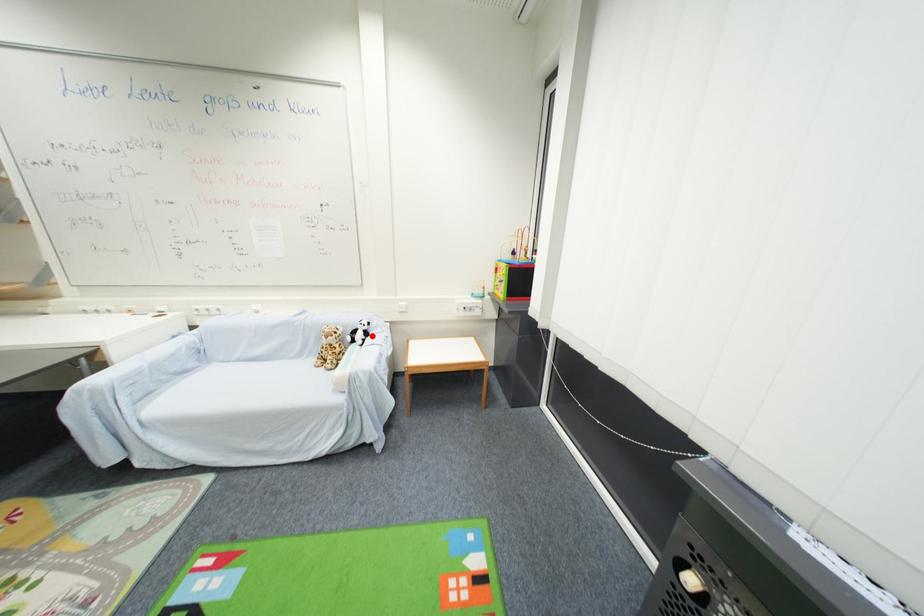
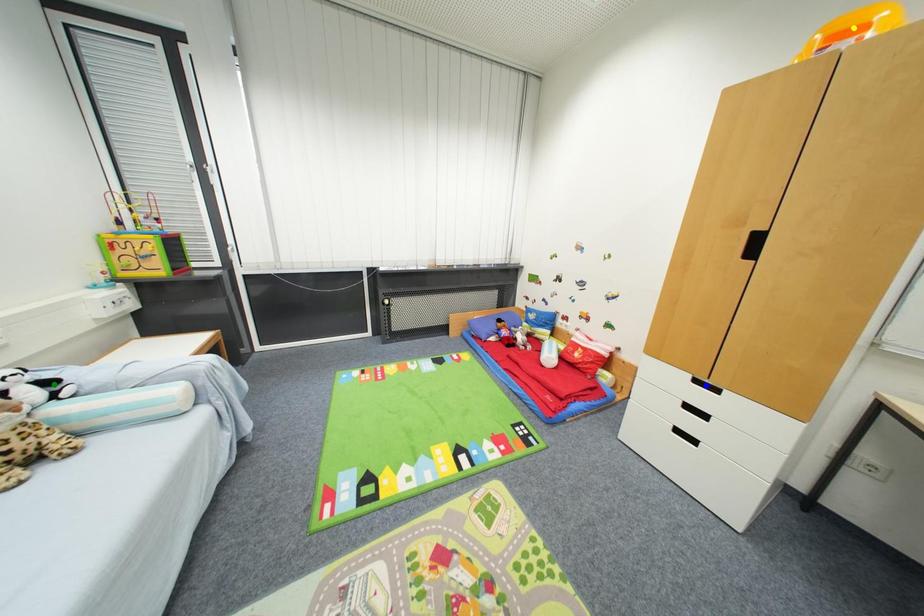
Question: I am providing you with two images of the same scene from different viewpoints. A red point is marked on the first image. You are given multiple points on the second image. Which point in image 2 represents the same 3d spot as the red point in image 1?

Choices:
 (A) yellow point
 (B) blue point
 (C) green point

Answer: (C)